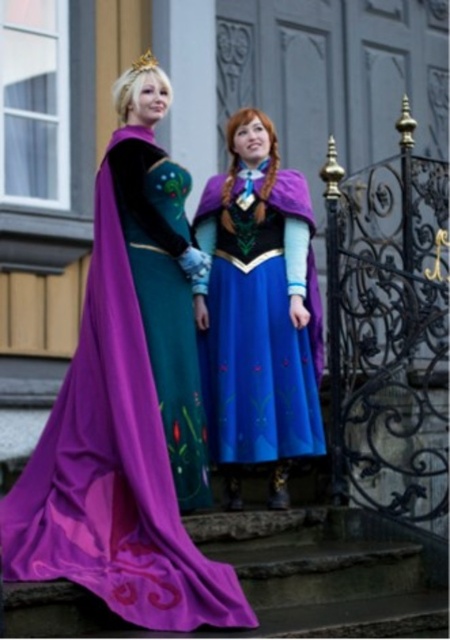
Question: Is purple satin cape at center thinner than blue satin dress at center?

Choices:
 (A) yes
 (B) no

Answer: (B)

Question: Does purple satin cape at center appear on the right side of gold metallic crown at upper center?

Choices:
 (A) yes
 (B) no

Answer: (B)

Question: Which point is farther to the camera?

Choices:
 (A) purple satin cape at center
 (B) blue satin dress at center
 (C) gold metallic crown at upper center

Answer: (C)

Question: Is the position of purple satin cape at center more distant than that of gold metallic crown at upper center?

Choices:
 (A) no
 (B) yes

Answer: (A)

Question: Estimate the real-world distances between objects in this image. Which object is closer to the gold metallic crown at upper center?

Choices:
 (A) blue satin dress at center
 (B) purple satin cape at center

Answer: (A)

Question: Which of the following is the farthest from the observer?

Choices:
 (A) (18, 538)
 (B) (282, 440)
 (C) (143, 61)

Answer: (C)